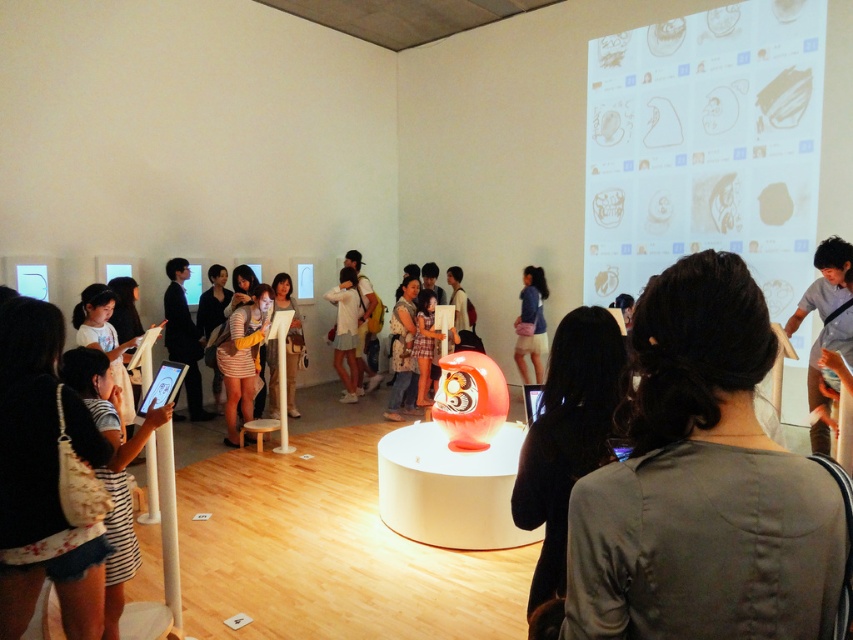
In the scene shown: Is striped fabric dress at center to the left of blue fabric skirt at center from the viewer's perspective?

Yes, striped fabric dress at center is to the left of blue fabric skirt at center.

This screenshot has height=640, width=853. Identify the location of striped fabric dress at center. (242, 358).

Where is `striped fabric dress at center`? This screenshot has height=640, width=853. striped fabric dress at center is located at coordinates (242, 358).

Is black fabric at center closer to the viewer compared to dark blue suit at center?

Yes, black fabric at center is in front of dark blue suit at center.

Does point (544, 472) come farther from viewer compared to point (169, 358)?

No, (544, 472) is closer to viewer.

Does point (585, 401) lie in front of point (178, 280)?

That is True.

This screenshot has height=640, width=853. What are the coordinates of `black fabric at center` in the screenshot? It's located at (x=569, y=435).

Is black fabric at center further to camera compared to striped fabric dress at center?

No, it is not.

Find the location of `black fabric at center`. black fabric at center is located at coordinates (569, 435).

The image size is (853, 640). Describe the element at coordinates (569, 435) in the screenshot. I see `black fabric at center` at that location.

Locate an element on the screen. This screenshot has height=640, width=853. black fabric at center is located at coordinates (569, 435).